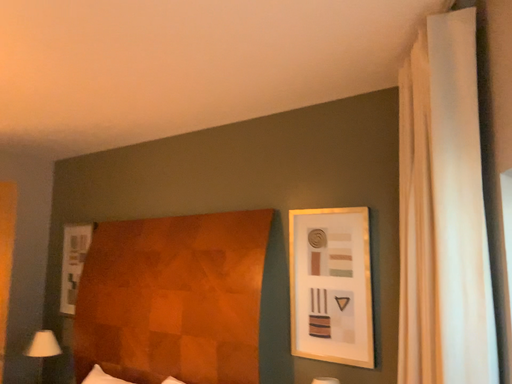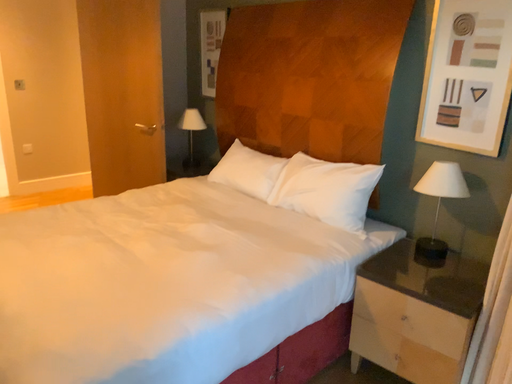
Question: Which way did the camera rotate in the video?

Choices:
 (A) rotated right
 (B) rotated left

Answer: (B)